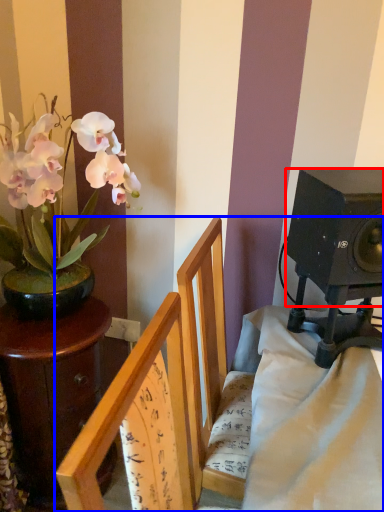
Question: Which point is further to the camera, loudspeaker (highlighted by a red box) or furniture (highlighted by a blue box)?

Choices:
 (A) loudspeaker
 (B) furniture

Answer: (A)